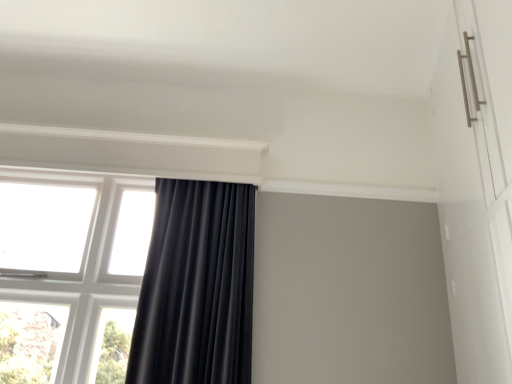
Question: Is transparent glass window at left wider or thinner than black velvet curtain at center?

Choices:
 (A) wide
 (B) thin

Answer: (B)

Question: From a real-world perspective, is transparent glass window at left above or below black velvet curtain at center?

Choices:
 (A) below
 (B) above

Answer: (B)

Question: Considering the positions of transparent glass window at left and black velvet curtain at center in the image, is transparent glass window at left taller or shorter than black velvet curtain at center?

Choices:
 (A) tall
 (B) short

Answer: (A)

Question: From the image's perspective, is black velvet curtain at center above or below transparent glass window at left?

Choices:
 (A) above
 (B) below

Answer: (A)

Question: Is black velvet curtain at center to the left or to the right of transparent glass window at left in the image?

Choices:
 (A) left
 (B) right

Answer: (B)

Question: From a real-world perspective, relative to transparent glass window at left, is black velvet curtain at center vertically above or below?

Choices:
 (A) below
 (B) above

Answer: (A)

Question: Is black velvet curtain at center taller or shorter than transparent glass window at left?

Choices:
 (A) short
 (B) tall

Answer: (A)